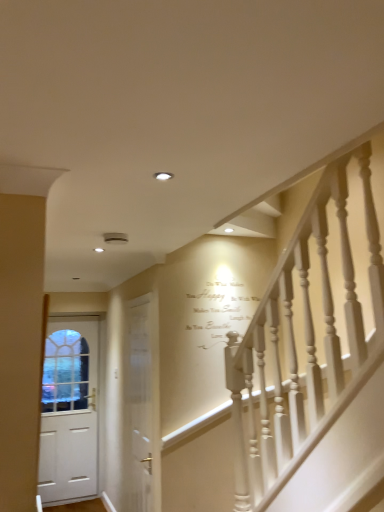
Question: Considering the positions of white wooden door at center, the 2th door viewed from the back, and white matte door at left, the 1th door positioned from the back, in the image, is white wooden door at center, the 2th door viewed from the back, wider or thinner than white matte door at left, the 1th door positioned from the back,?

Choices:
 (A) thin
 (B) wide

Answer: (A)

Question: Is white wooden door at center, which appears as the first door when viewed from the right, taller or shorter than white matte door at left, the 2th door in the right-to-left sequence?

Choices:
 (A) tall
 (B) short

Answer: (B)

Question: From the image's perspective, is white wooden door at center, which is the first door from front to back, positioned above or below white matte door at left, the 1th door positioned from the back?

Choices:
 (A) above
 (B) below

Answer: (A)

Question: From a real-world perspective, is white matte door at left, the 2th door in the right-to-left sequence, physically located above or below white wooden door at center, which ranks as the 2th door in left-to-right order?

Choices:
 (A) above
 (B) below

Answer: (B)

Question: Which is correct: white matte door at left, the 1th door when ordered from left to right, is inside white wooden door at center, which appears as the first door when viewed from the right, or outside of it?

Choices:
 (A) outside
 (B) inside

Answer: (A)

Question: From the image's perspective, is white matte door at left, which is the 2th door from front to back, positioned above or below white wooden door at center, which is the first door from front to back?

Choices:
 (A) above
 (B) below

Answer: (B)

Question: Looking at their shapes, would you say white matte door at left, the 1th door when ordered from left to right, is wider or thinner than white wooden door at center, which is the first door from front to back?

Choices:
 (A) wide
 (B) thin

Answer: (A)